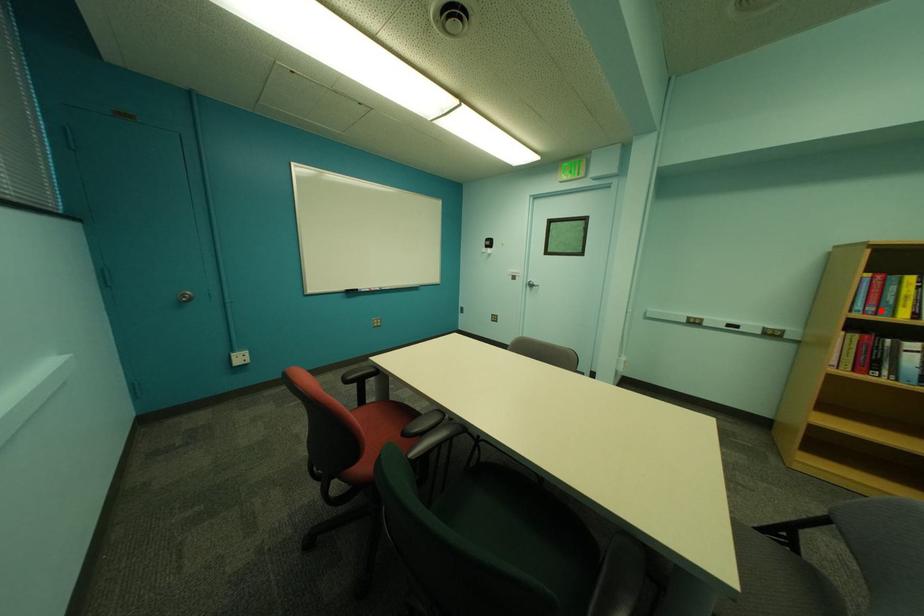
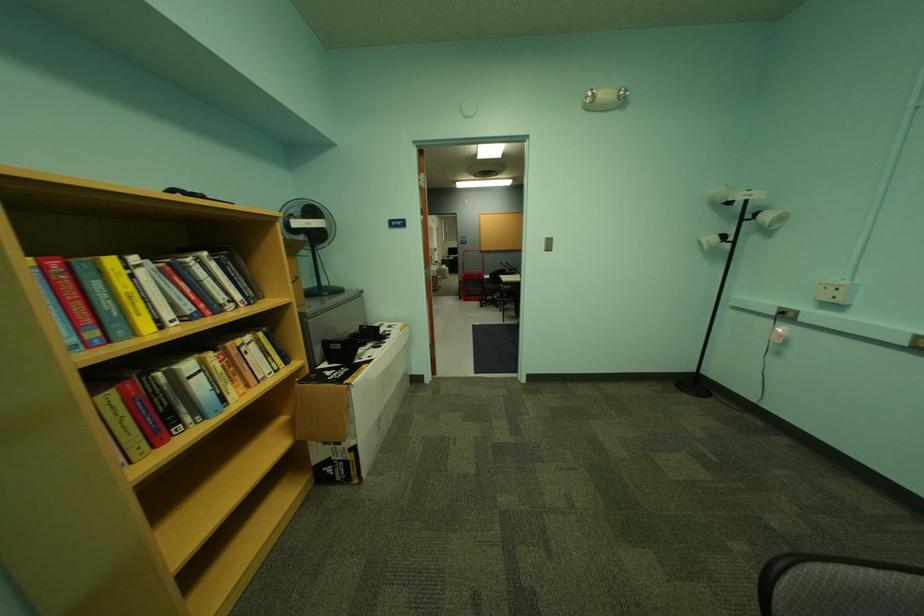
Find the pixel in the second image that matches the highlighted location in the first image.

(103, 334)